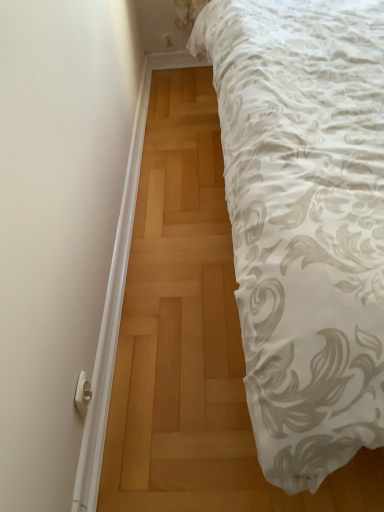
What is the approximate height of white floral fabric at upper right?

It is 32.56 inches.

The width and height of the screenshot is (384, 512). I want to click on white floral fabric at upper right, so click(x=304, y=222).

The image size is (384, 512). Describe the element at coordinates (304, 222) in the screenshot. I see `white floral fabric at upper right` at that location.

Where is `white plastic door handle at lower left`? The height and width of the screenshot is (512, 384). white plastic door handle at lower left is located at coordinates (82, 394).

This screenshot has height=512, width=384. What do you see at coordinates (82, 394) in the screenshot?
I see `white plastic door handle at lower left` at bounding box center [82, 394].

At what (x,y) coordinates should I click in order to perform the action: click on white floral fabric at upper right. Please return your answer as a coordinate pair (x, y). Looking at the image, I should click on (304, 222).

Considering the relative positions of white floral fabric at upper right and white plastic door handle at lower left in the image provided, is white floral fabric at upper right to the left or to the right of white plastic door handle at lower left?

white floral fabric at upper right is positioned on white plastic door handle at lower left's right side.

Based on the photo, between white floral fabric at upper right and white plastic door handle at lower left, which one is positioned in front?

white floral fabric at upper right is in front.

Is point (369, 191) closer to viewer compared to point (78, 398)?

Yes, point (369, 191) is closer to viewer.

Based on the photo, from the image's perspective, which is below, white floral fabric at upper right or white plastic door handle at lower left?

white plastic door handle at lower left.

From a real-world perspective, is white floral fabric at upper right on top of white plastic door handle at lower left?

Yes.

Is white floral fabric at upper right wider or thinner than white plastic door handle at lower left?

Clearly, white floral fabric at upper right has more width compared to white plastic door handle at lower left.

Can you confirm if white floral fabric at upper right is shorter than white plastic door handle at lower left?

No, white floral fabric at upper right is not shorter than white plastic door handle at lower left.

Can you confirm if white floral fabric at upper right is smaller than white plastic door handle at lower left?

No.

Is white floral fabric at upper right positioned beyond the bounds of white plastic door handle at lower left?

Yes, white floral fabric at upper right is outside of white plastic door handle at lower left.

Would you say white floral fabric at upper right is a long distance from white plastic door handle at lower left?

white floral fabric at upper right is actually quite close to white plastic door handle at lower left.

Is white floral fabric at upper right turned away from white plastic door handle at lower left?

No, white floral fabric at upper right is not facing away from white plastic door handle at lower left.

Can you tell me how much white floral fabric at upper right and white plastic door handle at lower left differ in facing direction?

The facing directions of white floral fabric at upper right and white plastic door handle at lower left are 180 degrees apart.

The width and height of the screenshot is (384, 512). I want to click on door handle that appears on the left of white floral fabric at upper right, so click(82, 394).

Considering the positions of objects white plastic door handle at lower left and white floral fabric at upper right in the image provided, who is more to the right, white plastic door handle at lower left or white floral fabric at upper right?

From the viewer's perspective, white floral fabric at upper right appears more on the right side.

Relative to white floral fabric at upper right, is white plastic door handle at lower left in front or behind?

Visually, white plastic door handle at lower left is located behind white floral fabric at upper right.

Between point (79, 402) and point (295, 354), which one is positioned behind?

Positioned behind is point (79, 402).

From the image's perspective, does white plastic door handle at lower left appear lower than white floral fabric at upper right?

Yes, from the image's perspective, white plastic door handle at lower left is beneath white floral fabric at upper right.

From a real-world perspective, relative to white floral fabric at upper right, is white plastic door handle at lower left vertically above or below?

From a real-world perspective, white plastic door handle at lower left is physically below white floral fabric at upper right.

Which object is thinner, white plastic door handle at lower left or white floral fabric at upper right?

With smaller width is white plastic door handle at lower left.

Considering the sizes of white plastic door handle at lower left and white floral fabric at upper right in the image, is white plastic door handle at lower left taller or shorter than white floral fabric at upper right?

In the image, white plastic door handle at lower left appears to be shorter than white floral fabric at upper right.

Considering the sizes of white plastic door handle at lower left and white floral fabric at upper right in the image, is white plastic door handle at lower left bigger or smaller than white floral fabric at upper right?

Considering their sizes, white plastic door handle at lower left takes up less space than white floral fabric at upper right.

In the scene shown: Could white floral fabric at upper right be considered to be inside white plastic door handle at lower left?

Actually, white floral fabric at upper right is outside white plastic door handle at lower left.

Does white plastic door handle at lower left touch white floral fabric at upper right?

No, white plastic door handle at lower left is not touching white floral fabric at upper right.

Is white plastic door handle at lower left oriented towards white floral fabric at upper right?

Yes, white plastic door handle at lower left is oriented towards white floral fabric at upper right.

The image size is (384, 512). In order to click on bed on the right of white plastic door handle at lower left in this screenshot , I will do `click(304, 222)`.

Image resolution: width=384 pixels, height=512 pixels. I want to click on door handle below the white floral fabric at upper right (from a real-world perspective), so click(x=82, y=394).

The image size is (384, 512). I want to click on door handle behind the white floral fabric at upper right, so click(x=82, y=394).